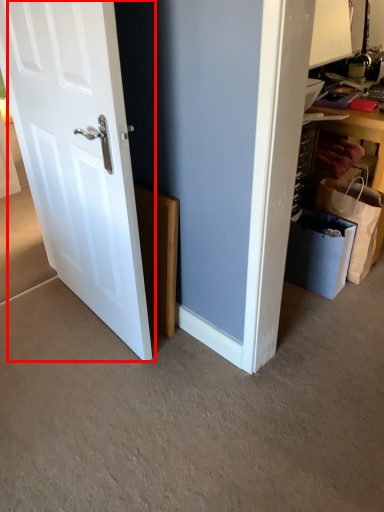
Question: From the image's perspective, where is door (annotated by the red box) located relative to shopping bag?

Choices:
 (A) above
 (B) below

Answer: (A)